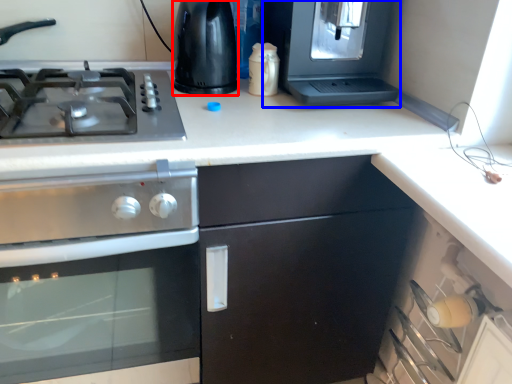
Question: Which of the following is the closest to the observer, appliance (highlighted by a red box) or appliance (highlighted by a blue box)?

Choices:
 (A) appliance
 (B) appliance

Answer: (B)